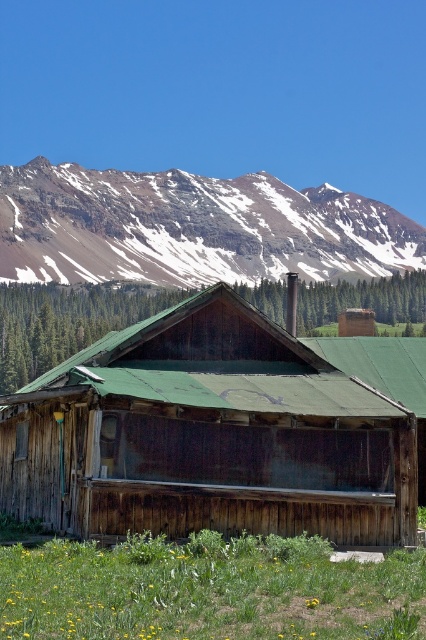
Question: Is rusty wood log cabin at center further to the viewer compared to snowy rocky mountain at upper center?

Choices:
 (A) no
 (B) yes

Answer: (A)

Question: Which of the following is the farthest from the observer?

Choices:
 (A) snowy rocky mountain at upper center
 (B) rusty wood log cabin at center

Answer: (A)

Question: Which of the following is the farthest from the observer?

Choices:
 (A) (261, 436)
 (B) (204, 225)

Answer: (B)

Question: Can you confirm if rusty wood log cabin at center is thinner than snowy rocky mountain at upper center?

Choices:
 (A) yes
 (B) no

Answer: (A)

Question: Observing the image, what is the correct spatial positioning of rusty wood log cabin at center in reference to snowy rocky mountain at upper center?

Choices:
 (A) above
 (B) below

Answer: (B)